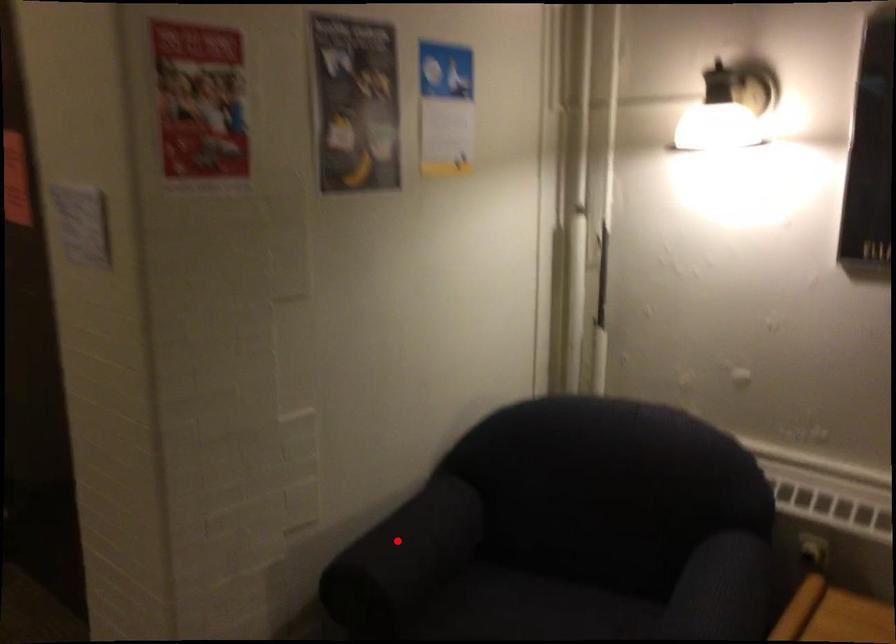
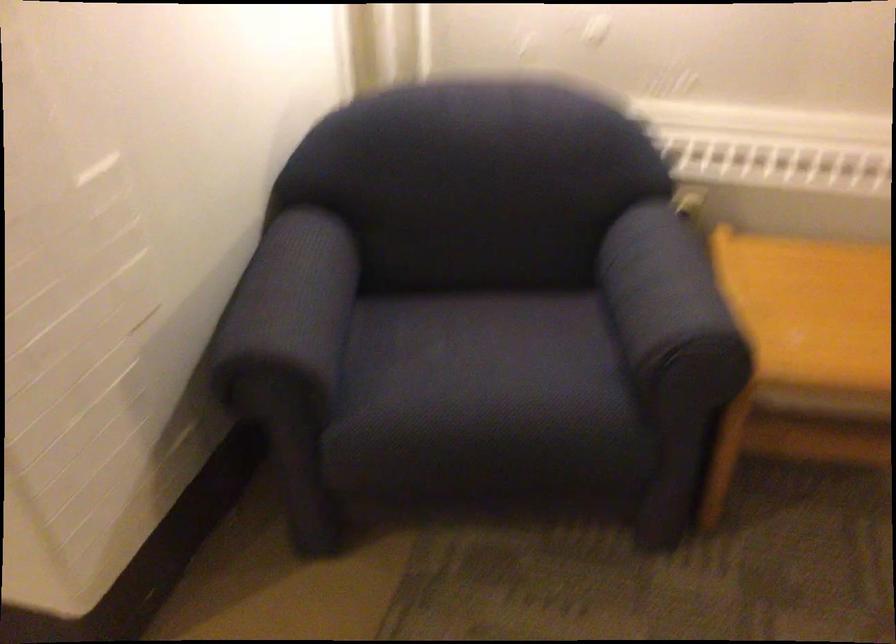
Find the pixel in the second image that matches the highlighted location in the first image.

(289, 307)